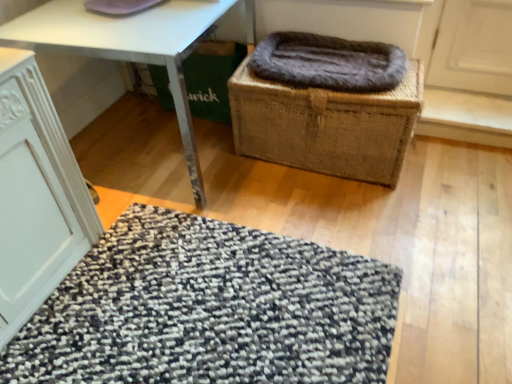
I want to click on blank space situated above woven brown basket at center (from a real-world perspective), so click(x=302, y=62).